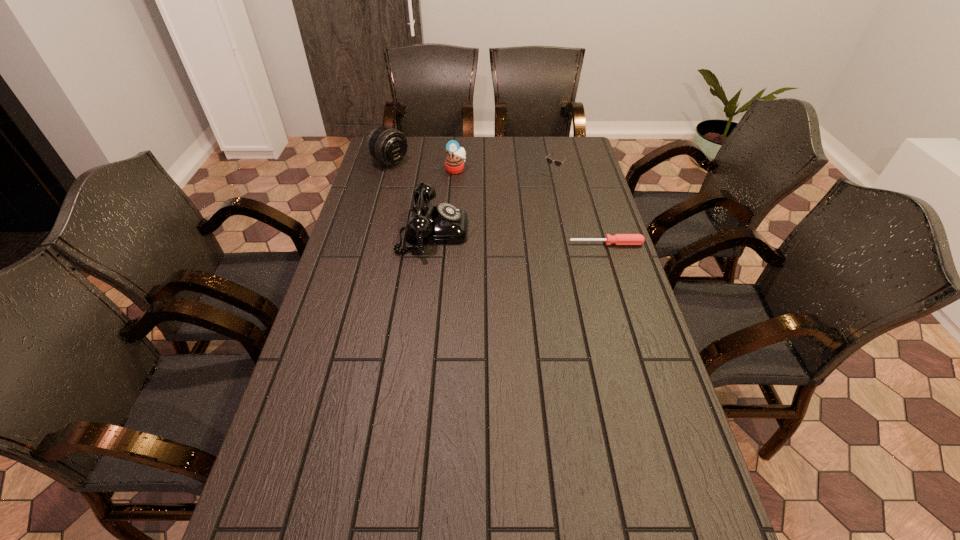
Find the location of a particular element. This screenshot has height=540, width=960. telephone is located at coordinates (442, 224).

What are the coordinates of `the shortest object` in the screenshot? It's located at (618, 239).

You are a GUI agent. You are given a task and a screenshot of the screen. Output one action in this format:
    pyautogui.click(x=<x>, y=<y>)
    Task: Click on the muffin
    Image resolution: width=960 pixels, height=540 pixels.
    Given the screenshot: What is the action you would take?
    pyautogui.click(x=454, y=162)

Where is `sunglasses`? The image size is (960, 540). sunglasses is located at coordinates (549, 160).

The height and width of the screenshot is (540, 960). What are the coordinates of `the leftmost object` in the screenshot? It's located at (387, 145).

Identify the location of free point located 0.320m on the dial of the telephone. (562, 231).

Find the location of a particular element. vacant space located 0.070m at the blade of the shortest object is located at coordinates (612, 261).

Locate an element on the screen. The width and height of the screenshot is (960, 540). vacant point located 0.210m on the front-facing side of the muffin is located at coordinates (489, 201).

Locate an element on the screen. vacant space located on the front-facing side of the muffin is located at coordinates (516, 228).

Where is `vacant space located on the front-facing side of the muffin`? This screenshot has width=960, height=540. vacant space located on the front-facing side of the muffin is located at coordinates (516, 228).